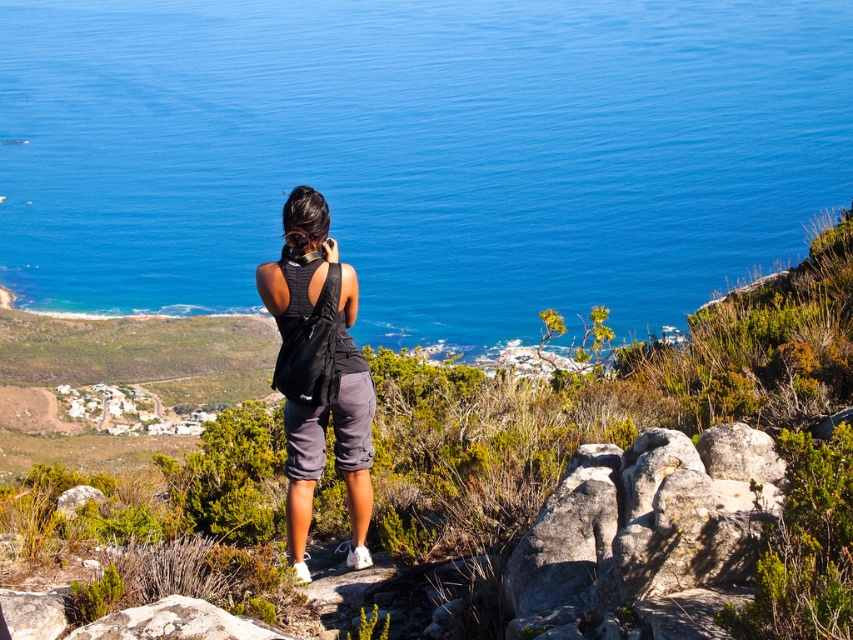
Does blue water at center have a greater height compared to gray rough rock at lower left?

Indeed, blue water at center has a greater height compared to gray rough rock at lower left.

Consider the image. Who is more forward, [462,76] or [204,621]?

Positioned in front is point [204,621].

Does point (381, 266) lie behind point (184, 624)?

Yes, it is behind point (184, 624).

Find the location of a particular element. blue water at center is located at coordinates tap(419, 154).

Is point (236, 298) in front of point (534, 584)?

No.

Is point (412, 80) farther from camera compared to point (746, 500)?

Yes, point (412, 80) is behind point (746, 500).

Is point (500, 132) positioned after point (727, 456)?

Yes, point (500, 132) is farther from viewer.

Locate an element on the screen. This screenshot has width=853, height=640. blue water at center is located at coordinates (419, 154).

Is point (231, 200) positioned before point (346, 490)?

No, (231, 200) is further to viewer.

Does blue water at center have a greater height compared to black fabric backpack at center?

Correct, blue water at center is much taller as black fabric backpack at center.

Does point (80, 182) come in front of point (265, 268)?

No, it is not.

The height and width of the screenshot is (640, 853). What are the coordinates of `blue water at center` in the screenshot? It's located at (419, 154).